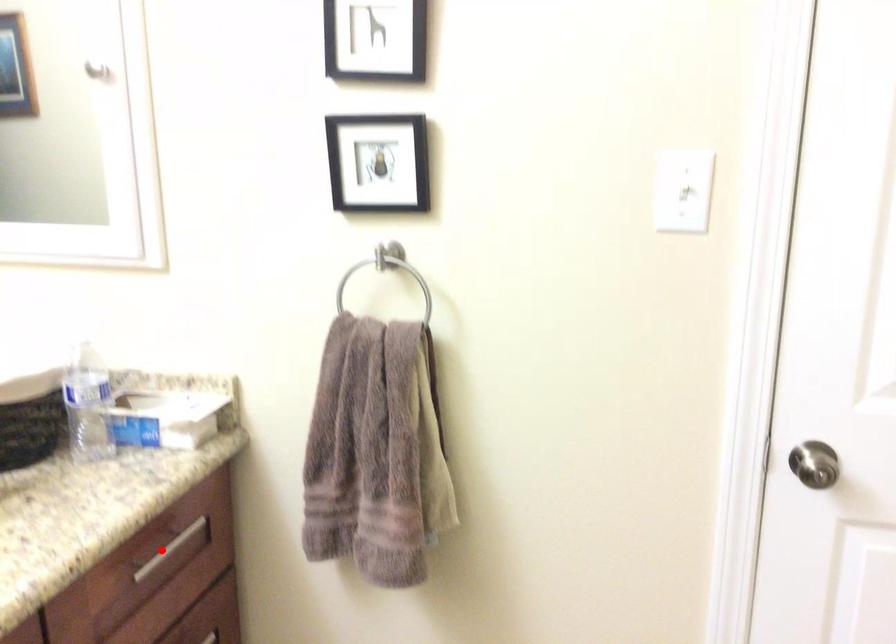
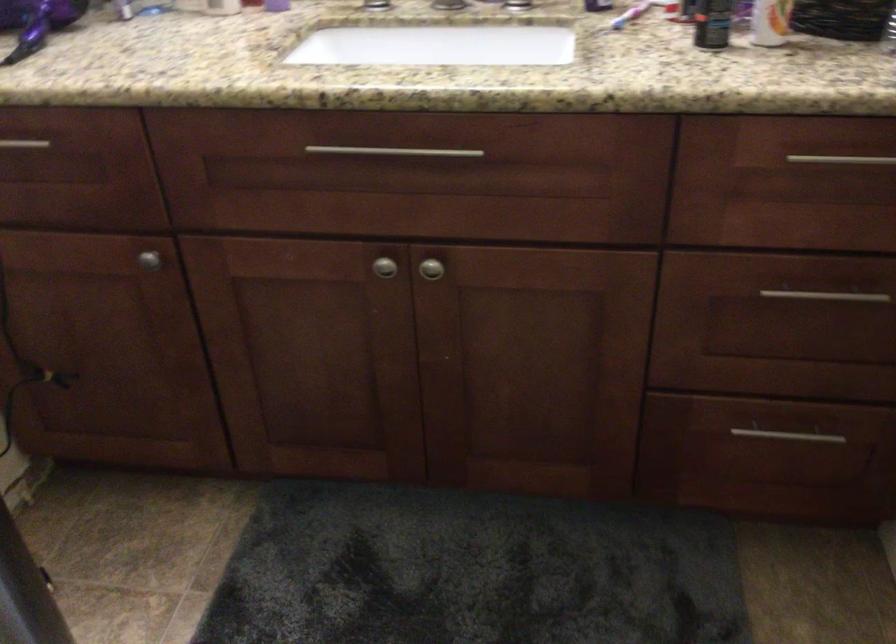
Question: I am providing you with two images of the same scene from different viewpoints. Image1 has a red point marked. In image2, the corresponding 3D location appears at what relative position? Reply with the corresponding letter.

Choices:
 (A) Closer
 (B) Farther

Answer: (A)